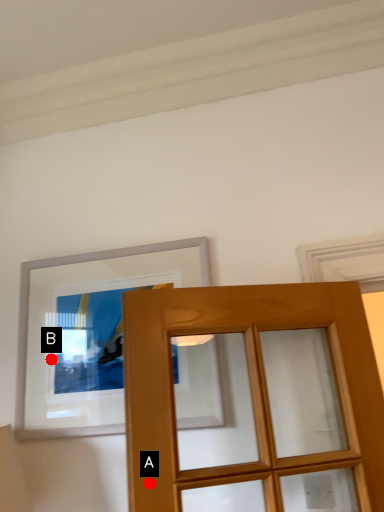
Question: Two points are circled on the image, labeled by A and B beside each circle. Which of the following is the closest to the observer?

Choices:
 (A) A is closer
 (B) B is closer

Answer: (A)